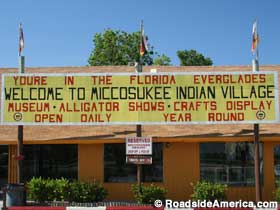
I want to click on window, so click(56, 163), click(116, 160), click(239, 168), click(277, 169).